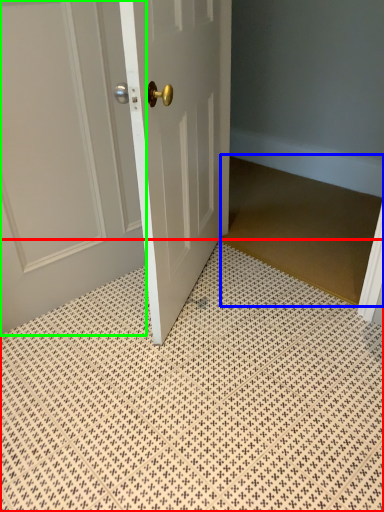
Question: Estimate the real-world distances between objects in this image. Which object is farther from bath mat (highlighted by a red box), doormat (highlighted by a blue box) or door (highlighted by a green box)?

Choices:
 (A) doormat
 (B) door

Answer: (A)